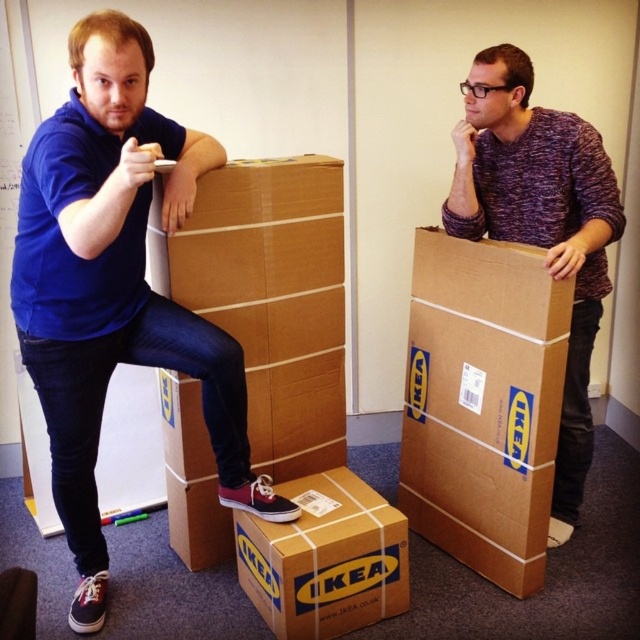
Measure the distance between brown cardboard box at right and brown cardboard box at lower center.

brown cardboard box at right is 21.82 inches from brown cardboard box at lower center.

How far apart are brown cardboard box at right and brown cardboard box at lower center?

A distance of 21.82 inches exists between brown cardboard box at right and brown cardboard box at lower center.

Is point (492, 260) positioned before point (246, 582)?

Yes, point (492, 260) is closer to viewer.

Locate an element on the screen. The height and width of the screenshot is (640, 640). brown cardboard box at right is located at coordinates (483, 403).

Who is more distant from viewer, (x=51, y=416) or (x=477, y=339)?

Point (x=477, y=339)

Between point (131, 289) and point (541, 317), which one is positioned behind?

The point (541, 317) is behind.

You are a GUI agent. You are given a task and a screenshot of the screen. Output one action in this format:
    pyautogui.click(x=<x>, y=<y>)
    Task: Click on the matte blue shirt at left
    
    Given the screenshot: What is the action you would take?
    pyautogui.click(x=115, y=285)

Can you confirm if brown cardboard box at right is thinner than purple knitted sweater at upper right?

Yes.

Is point (435, 316) less distant than point (509, 145)?

No.

The image size is (640, 640). What do you see at coordinates (483, 403) in the screenshot?
I see `brown cardboard box at right` at bounding box center [483, 403].

In order to click on brown cardboard box at right in this screenshot , I will do `click(483, 403)`.